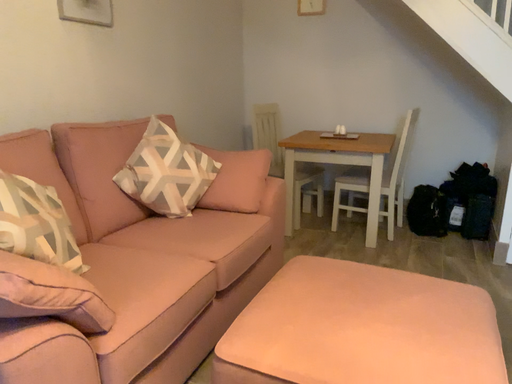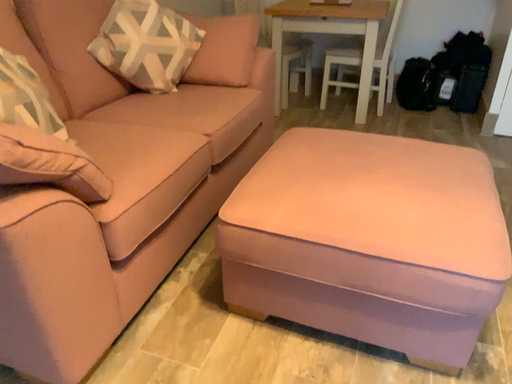
Question: Which way did the camera rotate in the video?

Choices:
 (A) rotated upward
 (B) rotated downward

Answer: (B)